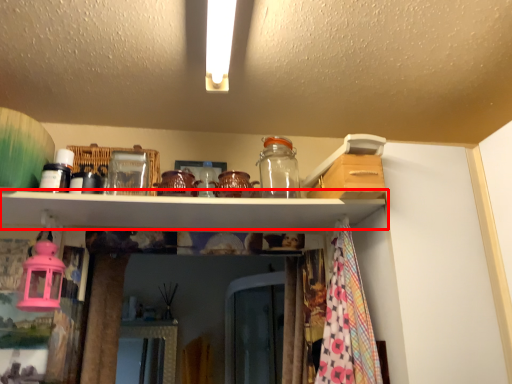
Question: From the image's perspective, what is the correct spatial positioning of shelf (annotated by the red box) in reference to glass jar?

Choices:
 (A) below
 (B) above

Answer: (A)